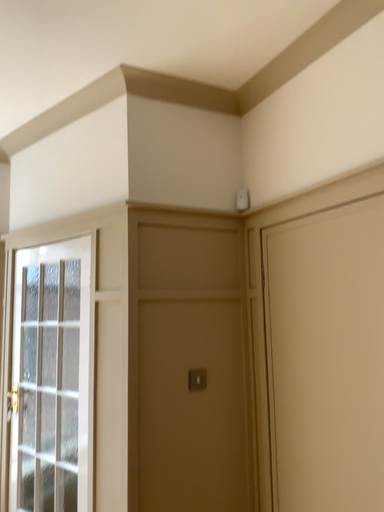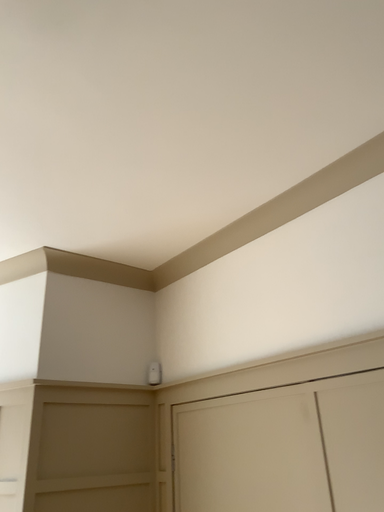
Question: Which way did the camera rotate in the video?

Choices:
 (A) rotated downward
 (B) rotated upward

Answer: (B)